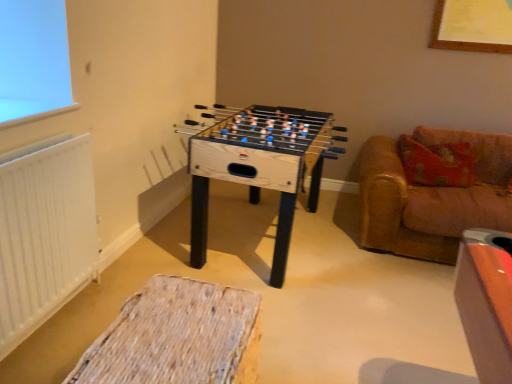
This screenshot has width=512, height=384. In order to click on vacant space underneath white matte radiator at left (from a real-world perspective) in this screenshot , I will do `click(48, 326)`.